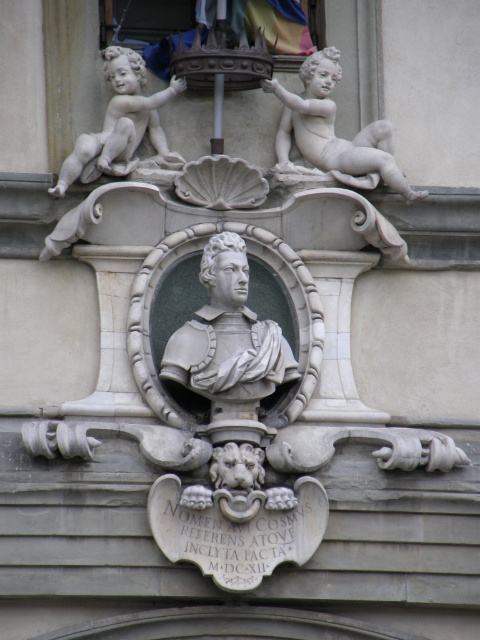
You are an architect inspecting the building facade. You notice the gray stone bust at center and the white marble cherub at upper left. Which object is located above the other?

The white marble cherub at upper left is above the gray stone bust at center because the gray stone bust at center is positioned under the white marble cherub at upper left.